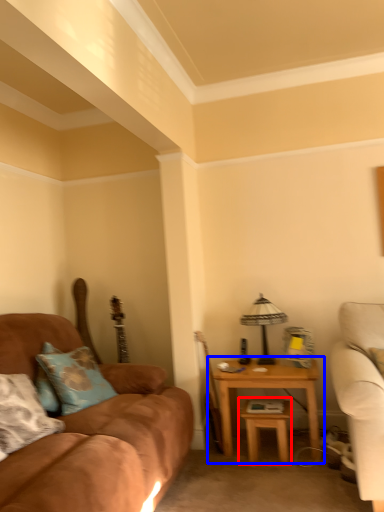
Question: Among these objects, which one is nearest to the camera, table (highlighted by a red box) or table (highlighted by a blue box)?

Choices:
 (A) table
 (B) table

Answer: (A)